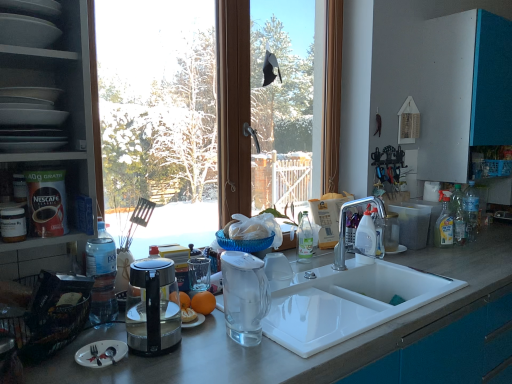
Where is `vacant space positioned to the left of silver matte fork at lower left`? This screenshot has width=512, height=384. vacant space positioned to the left of silver matte fork at lower left is located at coordinates (57, 361).